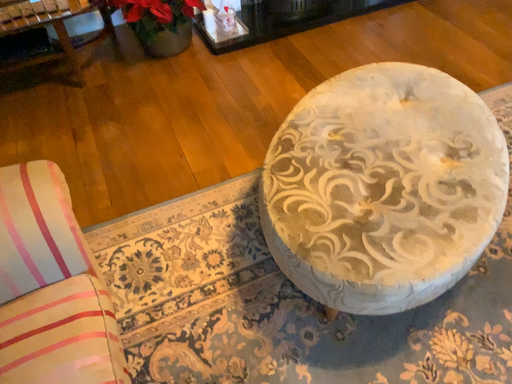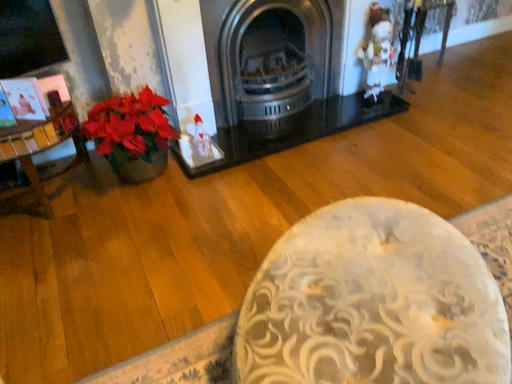
Question: How did the camera likely rotate when shooting the video?

Choices:
 (A) rotated downward
 (B) rotated upward

Answer: (B)